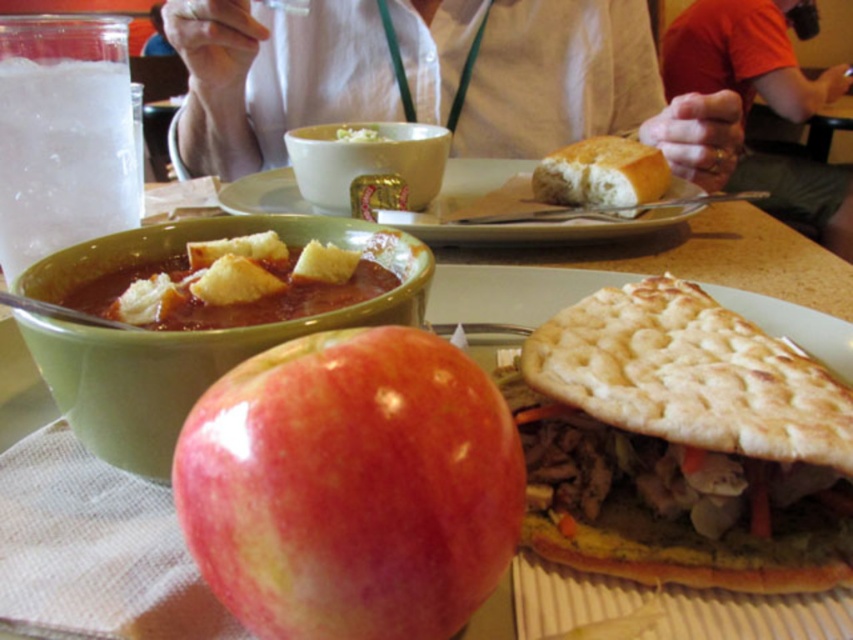
You are a customer sitting at the table in the image. You want to place your phone on the table so that it is closest to the point at coordinates point (589,90). Which object from the following list would you place it next to to achieve this? The options are the red apple on the napkin, the sandwich, or the green soup bowl.

The point (589,90) is located on the white fabric shirt at upper center. To place the phone closest to this point, you should place it next to the red apple on the napkin since it is the closest object to the point among the listed options.

You are a food delivery person who needs to stack the golden brown pita bread at center and the golden crusty bread at upper center into a small box. Based on their heights, which one should you place at the bottom to ensure stability?

The golden brown pita bread at center has a lesser height compared to golden crusty bread at upper center, so placing the taller golden crusty bread at upper center at the bottom would provide a more stable base.